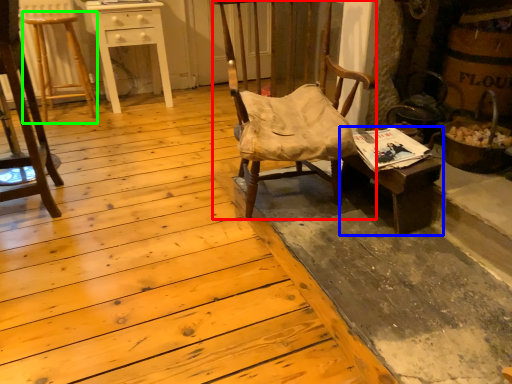
Question: Which is nearer to the chair (highlighted by a red box)? desk (highlighted by a blue box) or bar stool (highlighted by a green box).

Choices:
 (A) desk
 (B) bar stool

Answer: (A)